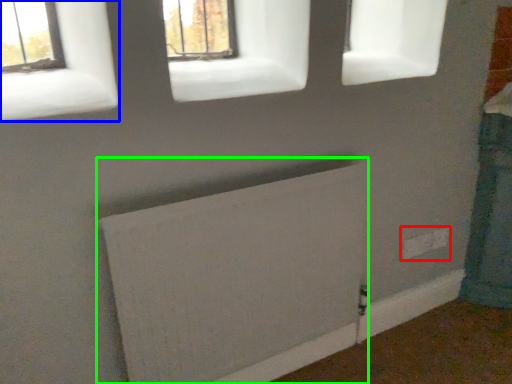
Question: Considering the real-world distances, which object is closest to electric outlet (highlighted by a red box)? window (highlighted by a blue box) or radiator (highlighted by a green box).

Choices:
 (A) window
 (B) radiator

Answer: (B)